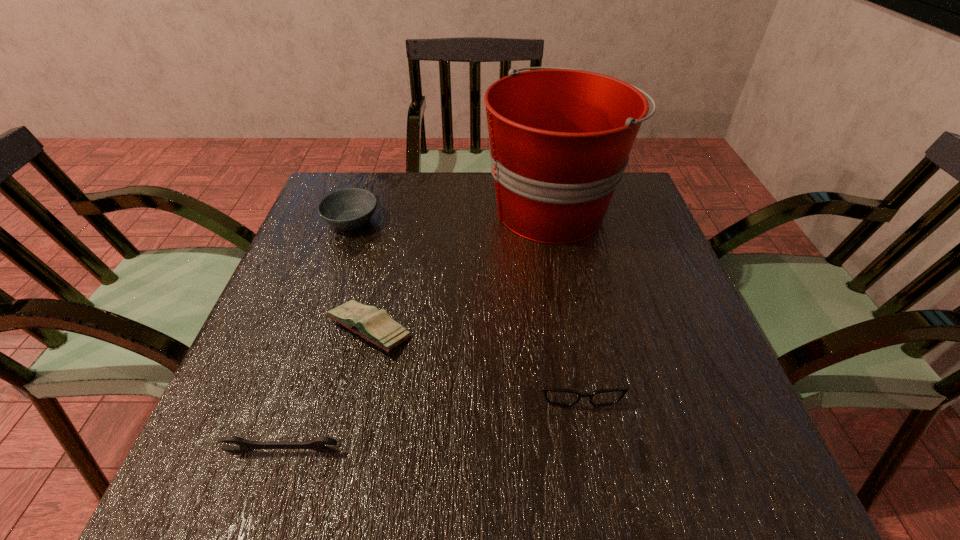
Where is `bucket`? Image resolution: width=960 pixels, height=540 pixels. bucket is located at coordinates (560, 139).

Where is `soup bowl`? Image resolution: width=960 pixels, height=540 pixels. soup bowl is located at coordinates (351, 208).

I want to click on diary, so click(x=376, y=326).

Where is `spectacles`? spectacles is located at coordinates (557, 396).

At what (x,y) coordinates should I click in order to perform the action: click on the nearest object. Please return your answer as a coordinate pair (x, y). This screenshot has width=960, height=540. Looking at the image, I should click on (317, 443).

Identify the location of blank space located on the left of the bucket. (364, 210).

Where is `free space located on the front of the soup bowl`? The width and height of the screenshot is (960, 540). free space located on the front of the soup bowl is located at coordinates (332, 278).

Where is `vacant point located on the right of the diary`? This screenshot has width=960, height=540. vacant point located on the right of the diary is located at coordinates (558, 330).

Locate an element on the screen. This screenshot has width=960, height=540. vacant space located on the front-facing side of the spectacles is located at coordinates (590, 448).

What are the coordinates of `bucket positioned at the far edge` in the screenshot? It's located at (560, 139).